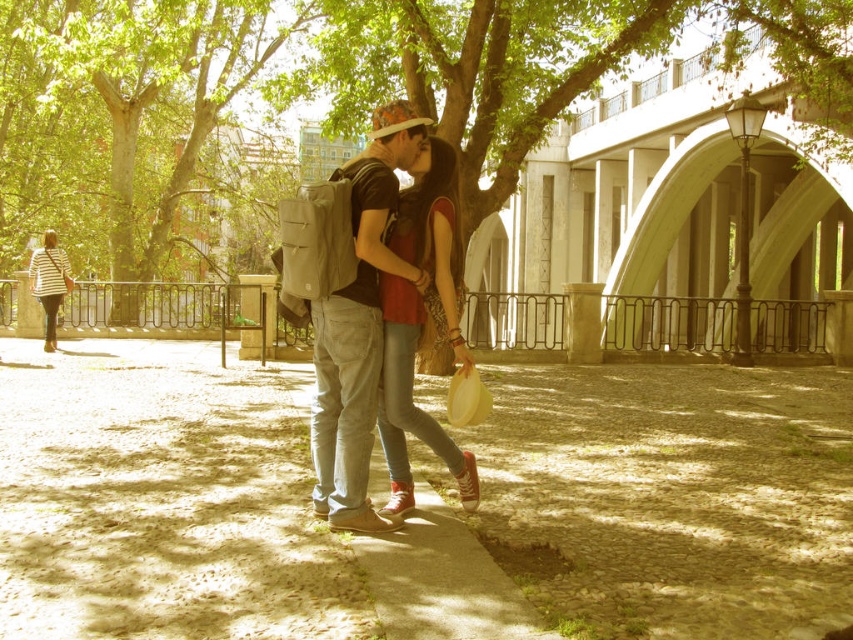
Question: Which of these objects is positioned farthest from the green leafy tree at center?

Choices:
 (A) striped fabric bag at left
 (B) green leafy tree at left
 (C) matte gray backpack at center

Answer: (C)

Question: Which point appears farthest from the camera in this image?

Choices:
 (A) (820, 3)
 (B) (51, 324)
 (C) (407, 360)
 (D) (393, 285)

Answer: (B)

Question: Is the position of green leafy tree at center more distant than that of matte gray backpack at center?

Choices:
 (A) yes
 (B) no

Answer: (A)

Question: Considering the relative positions of matte red sneakers at center and striped fabric bag at left in the image provided, where is matte red sneakers at center located with respect to striped fabric bag at left?

Choices:
 (A) left
 (B) right

Answer: (B)

Question: Which object is farther from the camera taking this photo?

Choices:
 (A) matte red sneakers at center
 (B) green leafy tree at center

Answer: (B)

Question: Is green leafy tree at center to the right of matte red sneakers at center from the viewer's perspective?

Choices:
 (A) yes
 (B) no

Answer: (B)